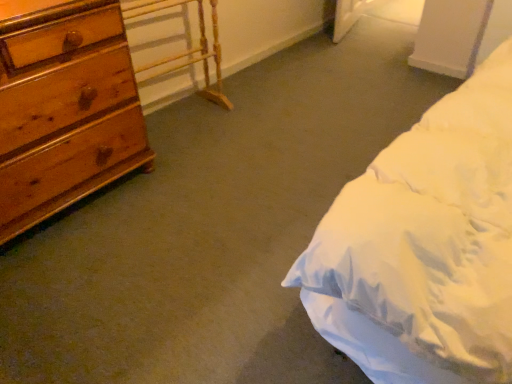
Question: Looking at the image, does wooden table at left seem bigger or smaller compared to wooden chest of drawers at left?

Choices:
 (A) big
 (B) small

Answer: (B)

Question: From a real-world perspective, is wooden table at left above or below wooden chest of drawers at left?

Choices:
 (A) above
 (B) below

Answer: (B)

Question: Is point (226, 107) closer or farther from the camera than point (88, 41)?

Choices:
 (A) closer
 (B) farther

Answer: (B)

Question: Would you say wooden chest of drawers at left is to the left or to the right of wooden table at left in the picture?

Choices:
 (A) left
 (B) right

Answer: (A)

Question: Considering their positions, is wooden chest of drawers at left located in front of or behind wooden table at left?

Choices:
 (A) front
 (B) behind

Answer: (A)

Question: Is point (143, 144) closer or farther from the camera than point (202, 67)?

Choices:
 (A) closer
 (B) farther

Answer: (A)

Question: From a real-world perspective, is wooden chest of drawers at left positioned above or below wooden table at left?

Choices:
 (A) below
 (B) above

Answer: (B)